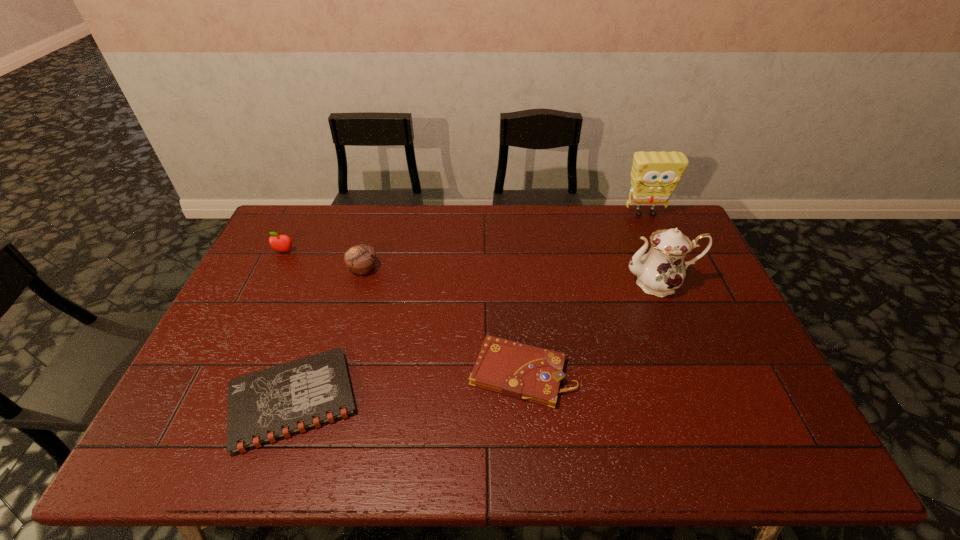
At what (x,y) coordinates should I click in order to perform the action: click on free space between the second shortest object and the chinaware. Please return your answer as a coordinate pair (x, y). The height and width of the screenshot is (540, 960). Looking at the image, I should click on (590, 328).

Identify the location of empty space that is in between the sponge and the fourth object from left to right. The width and height of the screenshot is (960, 540). (584, 293).

Locate an element on the screen. The image size is (960, 540). vacant space that's between the third object from right to left and the chinaware is located at coordinates (590, 328).

Locate an element on the screen. The image size is (960, 540). vacant area that lies between the chinaware and the muffin is located at coordinates (511, 276).

Locate an element on the screen. The height and width of the screenshot is (540, 960). vacant region between the chinaware and the muffin is located at coordinates (511, 276).

Locate an element on the screen. vacant point located between the farthest object and the right notebook is located at coordinates (584, 293).

This screenshot has width=960, height=540. I want to click on free space between the muffin and the taller notebook, so click(x=443, y=321).

Where is `free space between the second shortest object and the chinaware`? The height and width of the screenshot is (540, 960). free space between the second shortest object and the chinaware is located at coordinates (590, 328).

Identify the location of object that is the third closest to the apple. This screenshot has height=540, width=960. (521, 371).

Locate an element on the screen. The height and width of the screenshot is (540, 960). object that is the closest to the fifth nearest object is located at coordinates (361, 258).